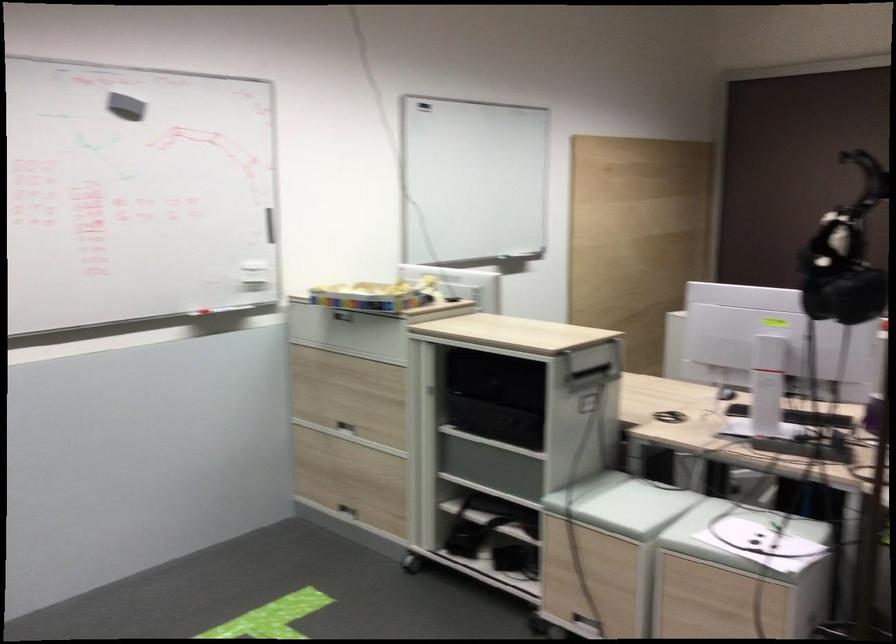
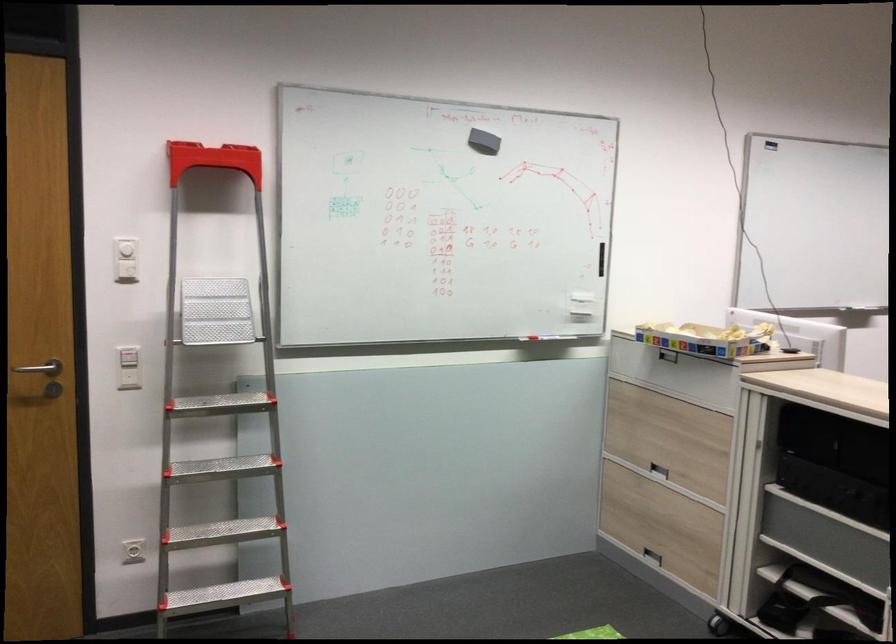
In the second image, find the point that corresponds to point (340, 319) in the first image.

(668, 355)